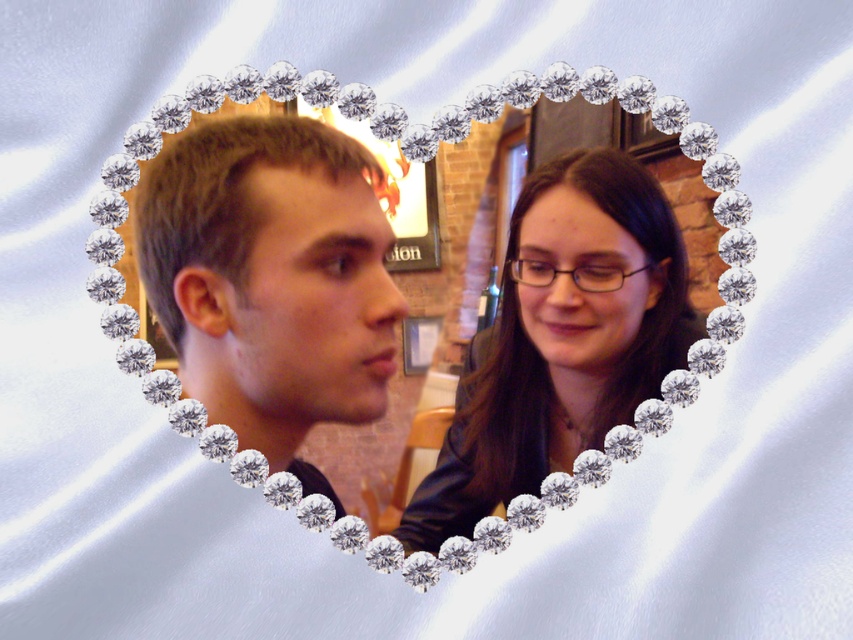
You are trying to locate the light brown hair at left in the image. According to the coordinates provided, which object corresponds to the point at (271,280)?

The point at (271,280) corresponds to the light brown hair at left.

You are a hairstylist who needs to style both the matte black hair at center and the light brown hair at left. Given that the minimum recommended distance between clients during styling is 2 feet, can you safely style both clients at the same time in this space?

The matte black hair at center is only 1.80 inches from light brown hair at left, which is much less than the required 2 feet. Therefore, you cannot safely style both clients at the same time in this space due to insufficient distance between them.